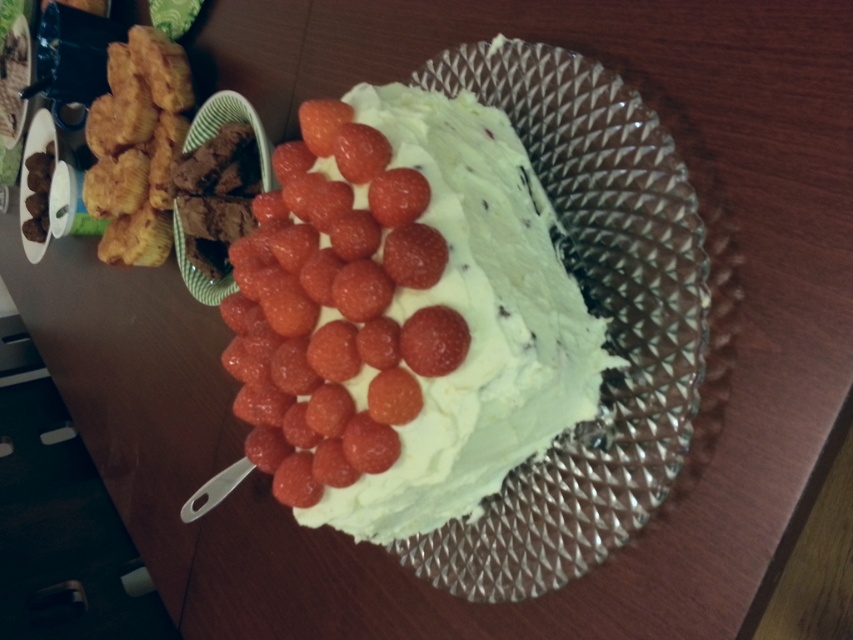
You are sitting at the wooden table and want to reach both the cake and the fried food. Which of the two points, point A at coordinates point (x=341, y=522) or point B at coordinates point (x=146, y=188), is closer to you?

Point A at coordinates point (x=341, y=522) is closer to you because it is in front of point B at coordinates point (x=146, y=188).

You are at a dinner table and see the clear glass plate at center and the golden fried chicken at left. Which object is positioned to the right of the other?

The clear glass plate at center is positioned to the right of the golden fried chicken at left.